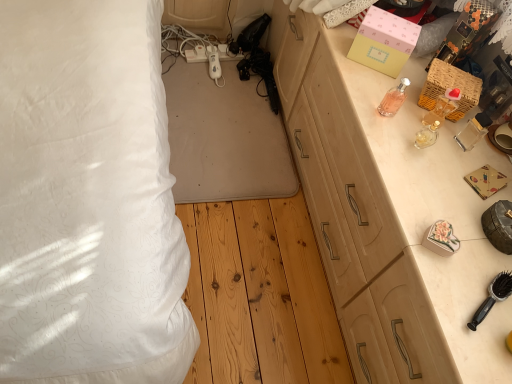
Where is `free spot in front of woven wicker basket at upper right, which is the second box from left to right`? free spot in front of woven wicker basket at upper right, which is the second box from left to right is located at coordinates (426, 142).